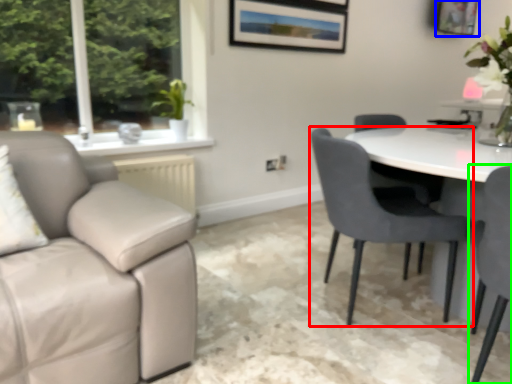
Question: Which object is positioned farthest from chair (highlighted by a red box)? Select from picture frame (highlighted by a blue box) and chair (highlighted by a green box).

Choices:
 (A) picture frame
 (B) chair

Answer: (A)